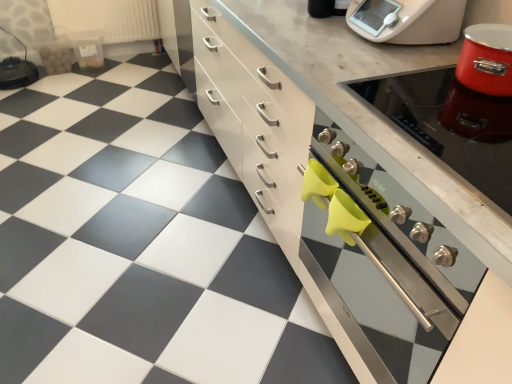
Question: From their relative heights in the image, would you say matte white cabinet at center is taller or shorter than white plastic radiator at upper left?

Choices:
 (A) short
 (B) tall

Answer: (B)

Question: In terms of width, does matte white cabinet at center look wider or thinner when compared to white plastic radiator at upper left?

Choices:
 (A) wide
 (B) thin

Answer: (A)

Question: Considering the real-world distances, which object is farthest from the shiny metallic stove at upper right?

Choices:
 (A) white plastic radiator at upper left
 (B) matte white cabinet at center
 (C) white plastic food processor at upper right
 (D) metallic silver oven at right

Answer: (A)

Question: Which object is the farthest from the white plastic food processor at upper right?

Choices:
 (A) matte white cabinet at center
 (B) metallic silver oven at right
 (C) shiny metallic stove at upper right
 (D) white plastic radiator at upper left

Answer: (D)